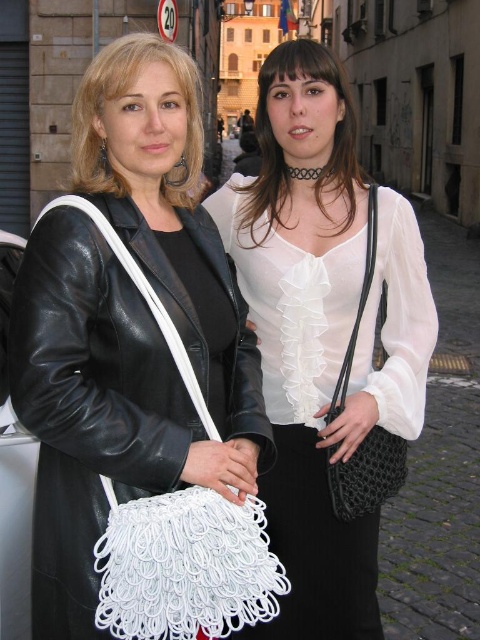
You are a photographer trying to capture a clear shot of both the white mesh bag at center and the white sheer blouse at center. Since they are both white, you need to adjust your camera settings to ensure proper exposure. Which object should you focus on first to balance the exposure between them?

The white mesh bag at center is positioned on the right side of white sheer blouse at center. To balance exposure, focus on the white sheer blouse at center first as it might have more texture and details that require accurate exposure, while the mesh bag can be adjusted afterward.

You are a photographer standing at the camera position. You want to take a photo of the two women but need to ensure they are both in focus. The camera has a depth of field that can cover 20 meters. Is the point at coordinates point (179, 429) within the depth of field range?

The point at coordinates point (179, 429) is 21.71 meters away from the camera, which exceeds the depth of field range of 20 meters. Therefore, it will not be in focus.

You are a photographer trying to capture a closeup of the matte black jacket at center. Based on the scene description, can you determine the exact coordinates where you should focus your camera lens to ensure the jacket is centered in the frame?

The exact coordinates to focus on are point (120, 97), as this is where the matte black jacket at center is located.